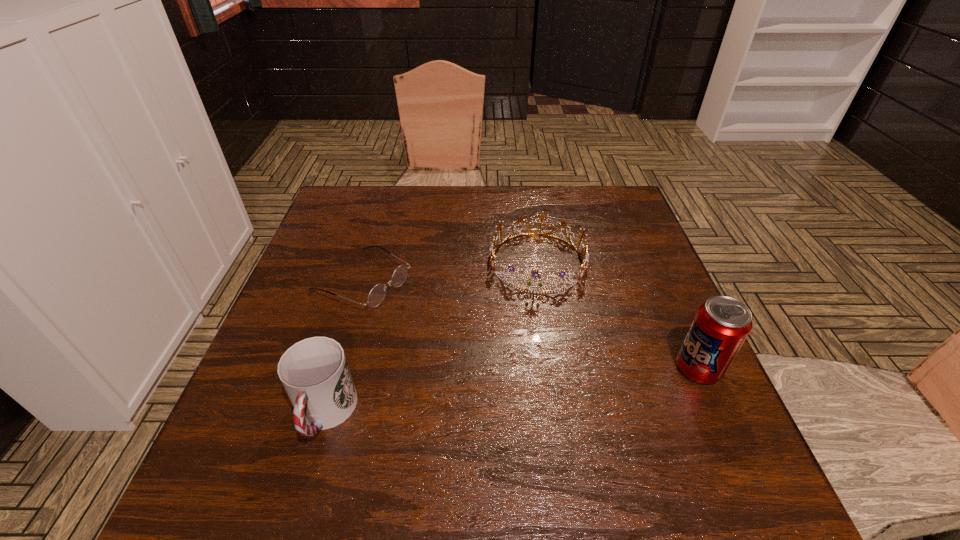
This screenshot has width=960, height=540. In order to click on unoccupied area between the cup and the spectacles in this screenshot , I will do `click(344, 347)`.

In order to click on free space between the cup and the second shortest object in this screenshot , I will do `click(431, 339)`.

Locate an element on the screen. The width and height of the screenshot is (960, 540). vacant space that is in between the shortest object and the tiara is located at coordinates (450, 271).

Where is `free space between the third shortest object and the soda can`? The height and width of the screenshot is (540, 960). free space between the third shortest object and the soda can is located at coordinates (512, 392).

At what (x,y) coordinates should I click in order to perform the action: click on free space that is in between the cup and the soda can. Please return your answer as a coordinate pair (x, y). Looking at the image, I should click on 512,392.

The width and height of the screenshot is (960, 540). In order to click on the closest object relative to the shortest object in this screenshot , I will do `click(314, 372)`.

Identify the location of object that ranks as the second closest to the tiara. (721, 325).

Find the location of a particular element. vacant region that satisfies the following two spatial constraints: 1. on the front side of the shortest object; 2. on the right side of the soda can is located at coordinates click(x=336, y=369).